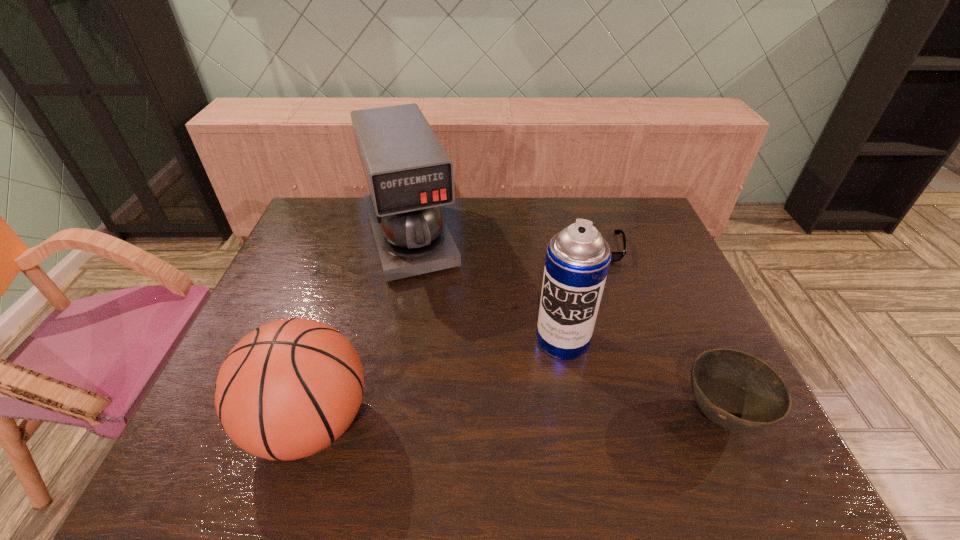
The height and width of the screenshot is (540, 960). In order to click on coffee maker situated at the far edge in this screenshot , I will do tap(409, 174).

At what (x,y) coordinates should I click in order to perform the action: click on basketball positioned at the near edge. Please return your answer as a coordinate pair (x, y). Looking at the image, I should click on (290, 388).

Identify the location of bowl present at the near edge. (x=738, y=391).

This screenshot has height=540, width=960. Identify the location of object positioned at the left edge. (290, 388).

I want to click on bowl located in the right edge section of the desktop, so tap(738, 391).

Where is `sunglasses that is at the right edge`? sunglasses that is at the right edge is located at coordinates (615, 256).

The width and height of the screenshot is (960, 540). Identify the location of object located at the near left corner. (290, 388).

Where is `object located at the far right corner`? The width and height of the screenshot is (960, 540). object located at the far right corner is located at coordinates (615, 256).

The image size is (960, 540). I want to click on object at the near right corner, so click(x=738, y=391).

The height and width of the screenshot is (540, 960). In order to click on free point at the far edge in this screenshot , I will do `click(362, 211)`.